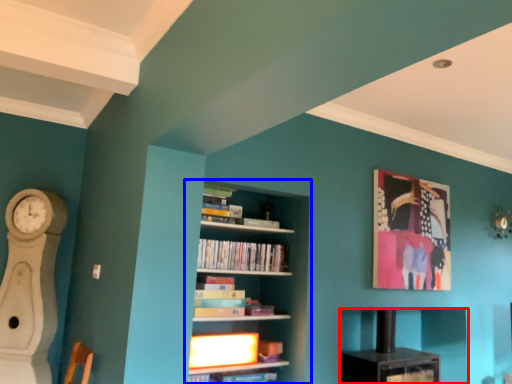
Question: Which object is further to the camera taking this photo, shelf (highlighted by a red box) or bookcase (highlighted by a blue box)?

Choices:
 (A) shelf
 (B) bookcase

Answer: (A)